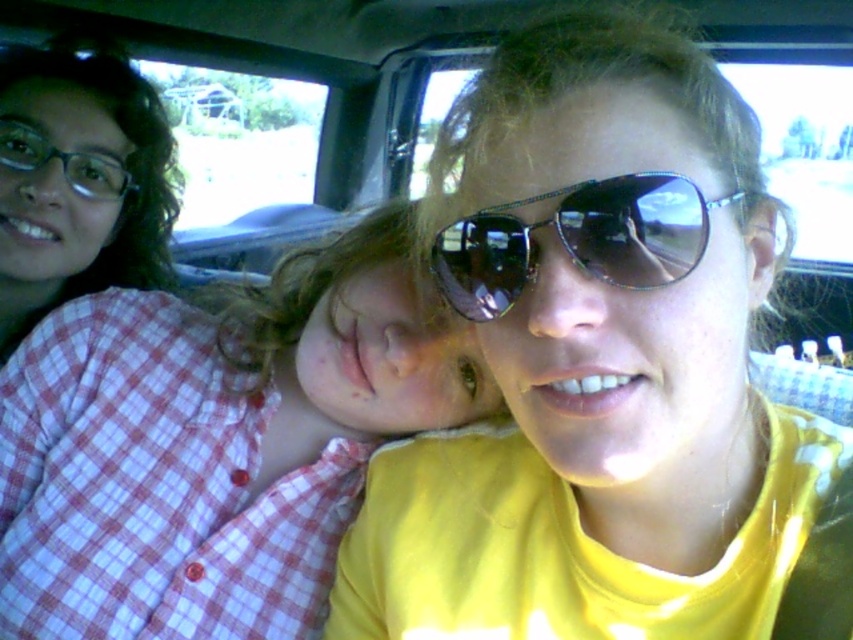
Is checkered fabric shirt at left shorter than metallic aviator sunglasses at center?

No, checkered fabric shirt at left is not shorter than metallic aviator sunglasses at center.

Does point (202, 564) come farther from viewer compared to point (569, 211)?

That is True.

Who is more distant from viewer, (262,497) or (625,234)?

The point (262,497) is more distant.

Locate an element on the screen. Image resolution: width=853 pixels, height=640 pixels. checkered fabric shirt at left is located at coordinates (215, 442).

Between point (193, 400) and point (120, 157), which one is positioned behind?

Point (120, 157)

You are a GUI agent. You are given a task and a screenshot of the screen. Output one action in this format:
    pyautogui.click(x=<x>, y=<y>)
    Task: Click on the checkered fabric shirt at left
    The image size is (853, 640).
    Given the screenshot: What is the action you would take?
    pyautogui.click(x=215, y=442)

Locate an element on the screen. The height and width of the screenshot is (640, 853). checkered fabric shirt at left is located at coordinates (215, 442).

How distant is metallic aviator sunglasses at center from matte black glasses at upper left?

A distance of 3.79 feet exists between metallic aviator sunglasses at center and matte black glasses at upper left.

Which is more to the right, metallic aviator sunglasses at center or matte black glasses at upper left?

metallic aviator sunglasses at center is more to the right.

Does point (642, 260) come in front of point (94, 179)?

That is True.

Find the location of a particular element. metallic aviator sunglasses at center is located at coordinates (577, 240).